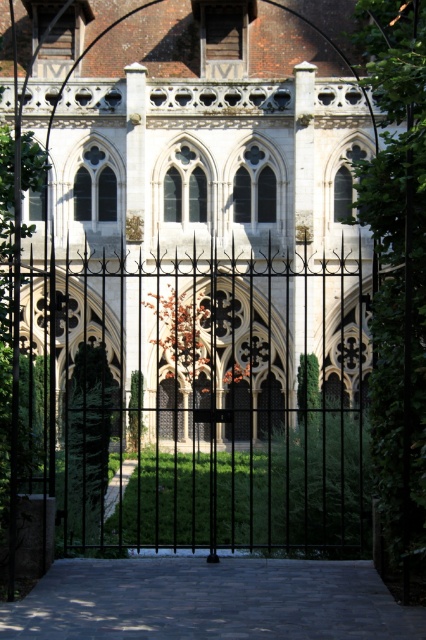
Question: Which object appears farthest from the camera in this image?

Choices:
 (A) white stone church at center
 (B) black wrought iron gate at center

Answer: (A)

Question: Is white stone church at center closer to the viewer compared to black wrought iron gate at center?

Choices:
 (A) no
 (B) yes

Answer: (A)

Question: Is white stone church at center to the left of black wrought iron gate at center from the viewer's perspective?

Choices:
 (A) no
 (B) yes

Answer: (A)

Question: Does white stone church at center have a smaller size compared to black wrought iron gate at center?

Choices:
 (A) yes
 (B) no

Answer: (B)